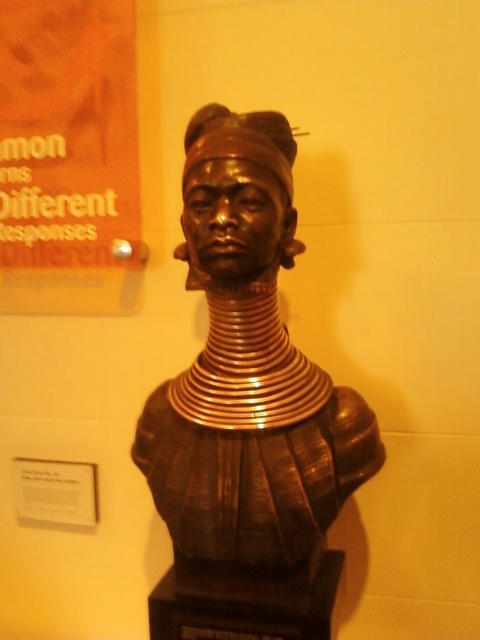
Question: Which object is the farthest from the gold metallic necklaces at center?

Choices:
 (A) bronze/textured head at center
 (B) bronze statue at center
 (C) gold metallic neck piece at center
 (D) white paper at lower left

Answer: (D)

Question: Which point appears farthest from the camera in this image?

Choices:
 (A) (273, 148)
 (B) (213, 312)
 (C) (96, 506)

Answer: (C)

Question: Can you confirm if white paper at lower left is smaller than gold metallic neck piece at center?

Choices:
 (A) yes
 (B) no

Answer: (B)

Question: Does bronze/textured head at center have a smaller size compared to gold metallic neck piece at center?

Choices:
 (A) no
 (B) yes

Answer: (A)

Question: Does bronze statue at center have a lesser width compared to gold metallic neck piece at center?

Choices:
 (A) yes
 (B) no

Answer: (B)

Question: Among these points, which one is farthest from the camera?

Choices:
 (A) (251, 362)
 (B) (29, 492)

Answer: (B)